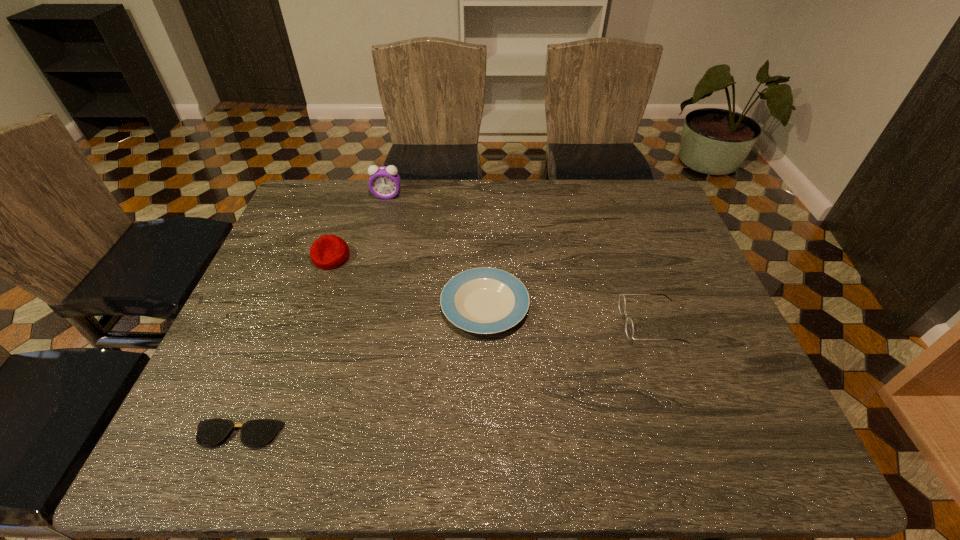
Find the location of a particular element. Image resolution: width=960 pixels, height=540 pixels. free space located on the face of the alarm clock is located at coordinates (382, 214).

The image size is (960, 540). Find the location of `free region located 0.200m on the seat area of the second farthest object`. free region located 0.200m on the seat area of the second farthest object is located at coordinates (307, 327).

Locate an element on the screen. The height and width of the screenshot is (540, 960). free space located on the front-facing side of the rightmost object is located at coordinates (520, 323).

Locate an element on the screen. This screenshot has width=960, height=540. vacant space situated 0.320m on the front-facing side of the rightmost object is located at coordinates (492, 323).

This screenshot has width=960, height=540. I want to click on free space located 0.170m on the front-facing side of the rightmost object, so click(553, 323).

Identify the location of vacant space positioned 0.100m on the left of the fourth object from left to right. The image size is (960, 540). (402, 306).

Find the location of a particular element. The width and height of the screenshot is (960, 540). free space located on the back of the shortest object is located at coordinates (260, 379).

Find the location of a particular element. object that is at the far edge is located at coordinates (384, 182).

Locate an element on the screen. This screenshot has height=540, width=960. object situated at the near edge is located at coordinates (254, 433).

Image resolution: width=960 pixels, height=540 pixels. I want to click on beanbag located in the left edge section of the desktop, so click(x=329, y=251).